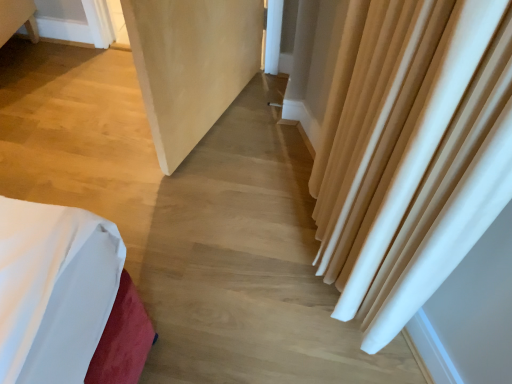
Question: Based on their positions, is beige fabric curtain at right located to the left or right of matte white screen door at center?

Choices:
 (A) right
 (B) left

Answer: (A)

Question: From a real-world perspective, is beige fabric curtain at right positioned above or below matte white screen door at center?

Choices:
 (A) above
 (B) below

Answer: (B)

Question: Considering the positions of beige fabric curtain at right and matte white screen door at center in the image, is beige fabric curtain at right taller or shorter than matte white screen door at center?

Choices:
 (A) tall
 (B) short

Answer: (B)

Question: From a real-world perspective, relative to beige fabric curtain at right, is matte white screen door at center vertically above or below?

Choices:
 (A) below
 (B) above

Answer: (B)

Question: Considering the positions of matte white screen door at center and beige fabric curtain at right in the image, is matte white screen door at center taller or shorter than beige fabric curtain at right?

Choices:
 (A) short
 (B) tall

Answer: (B)

Question: Relative to beige fabric curtain at right, is matte white screen door at center in front or behind?

Choices:
 (A) front
 (B) behind

Answer: (A)

Question: From the image's perspective, is matte white screen door at center positioned above or below beige fabric curtain at right?

Choices:
 (A) above
 (B) below

Answer: (A)